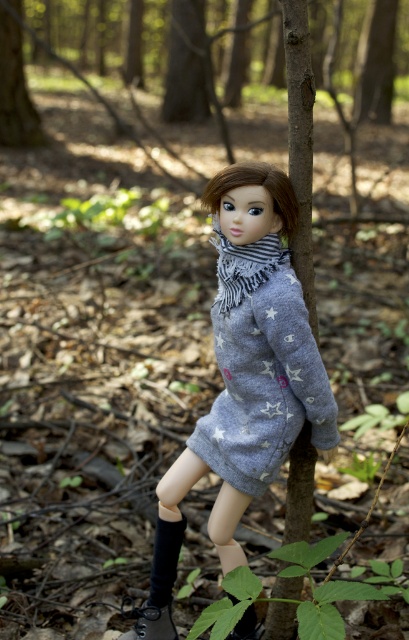
Question: Is gray knitted dress at center behind gray striped scarf at center?

Choices:
 (A) no
 (B) yes

Answer: (A)

Question: Is gray knitted dress at center to the right of brown rough bark at upper left from the viewer's perspective?

Choices:
 (A) no
 (B) yes

Answer: (B)

Question: Which point is closer to the camera taking this photo?

Choices:
 (A) (287, 397)
 (B) (11, 72)
 (C) (244, 385)
 (D) (271, 250)

Answer: (D)

Question: Observing the image, what is the correct spatial positioning of gray soft fabric dress at center in reference to gray striped scarf at center?

Choices:
 (A) left
 (B) right

Answer: (A)

Question: Which object appears farthest from the camera in this image?

Choices:
 (A) brown rough bark at upper left
 (B) gray knitted dress at center
 (C) gray striped scarf at center

Answer: (A)

Question: Which point appears farthest from the camera in this image?

Choices:
 (A) (249, 269)
 (B) (318, 356)
 (C) (325, 380)

Answer: (C)